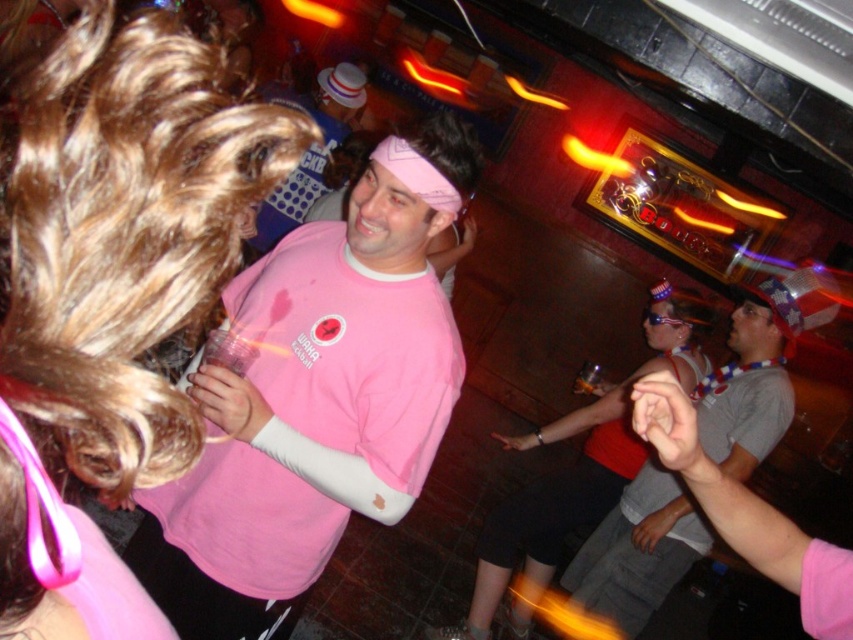
Does pink matte t-shirt at center have a lesser height compared to pink matte shirt at center?

Yes.

In the scene shown: Who is more forward, (242,282) or (254,248)?

Positioned in front is point (242,282).

Is point (144, 548) positioned after point (312, 168)?

No, (144, 548) is closer to viewer.

Find the location of `pink matte t-shirt at center`. pink matte t-shirt at center is located at coordinates (312, 403).

Consider the image. Is gray fabric shirt at center to the right of matte pink tank top at center from the viewer's perspective?

Indeed, gray fabric shirt at center is positioned on the right side of matte pink tank top at center.

Who is lower down, gray fabric shirt at center or matte pink tank top at center?

Positioned lower is matte pink tank top at center.

Locate an element on the screen. Image resolution: width=853 pixels, height=640 pixels. gray fabric shirt at center is located at coordinates (637, 548).

Is pink matte t-shirt at center to the right of gray fabric shirt at center from the viewer's perspective?

Incorrect, pink matte t-shirt at center is not on the right side of gray fabric shirt at center.

Does point (258, 634) come closer to viewer compared to point (705, 547)?

Yes.

Where is `pink matte t-shirt at center`? This screenshot has width=853, height=640. pink matte t-shirt at center is located at coordinates (312, 403).

Locate an element on the screen. The width and height of the screenshot is (853, 640). pink matte t-shirt at center is located at coordinates (312, 403).